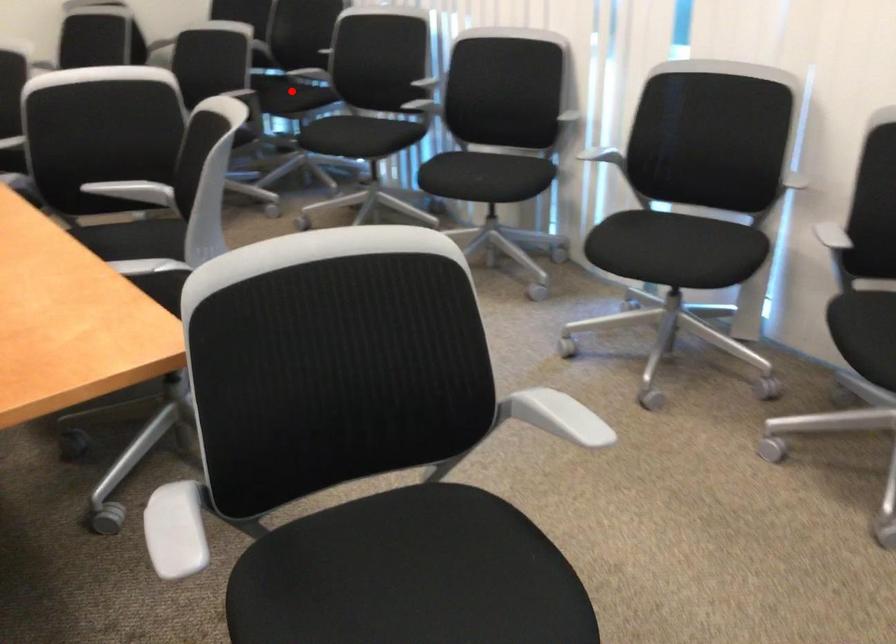
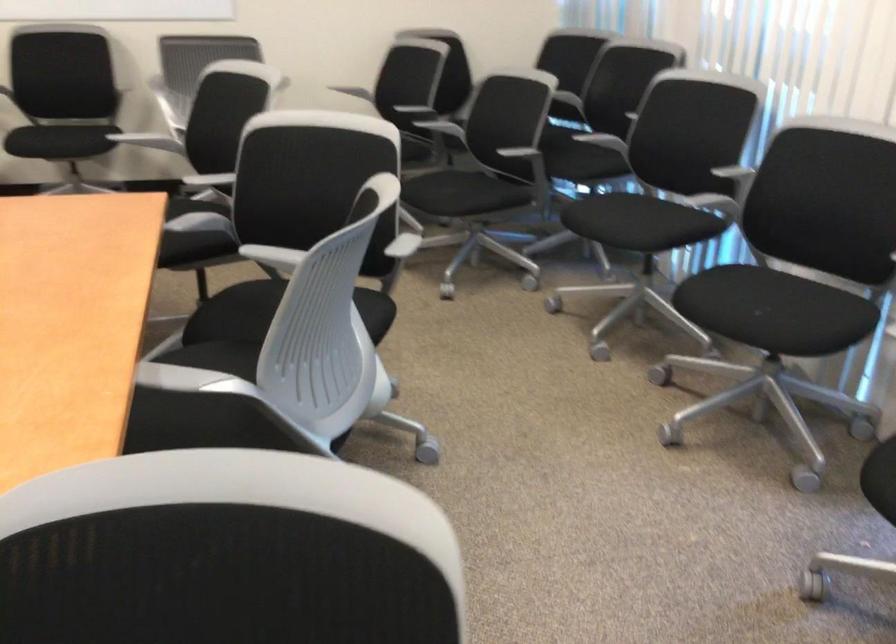
The point at the highlighted location is marked in the first image. Where is the corresponding point in the second image?

(588, 147)